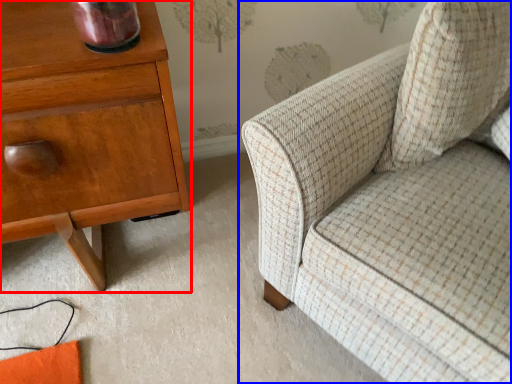
Question: Which object is closer to the camera taking this photo, nightstand (highlighted by a red box) or chair (highlighted by a blue box)?

Choices:
 (A) nightstand
 (B) chair

Answer: (B)